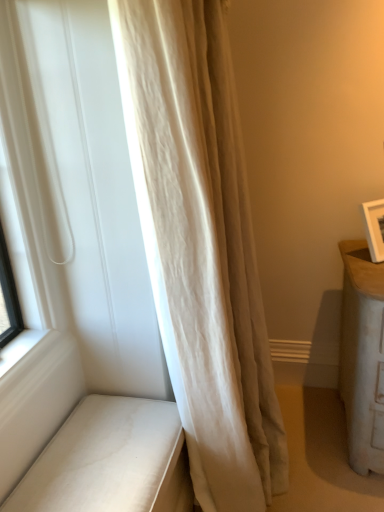
Question: Should I look upward or downward to see white leather bench at lower left?

Choices:
 (A) down
 (B) up

Answer: (A)

Question: Can you confirm if white leather bench at lower left is positioned to the left of beige silk curtain at left?

Choices:
 (A) no
 (B) yes

Answer: (B)

Question: Does white leather bench at lower left come behind beige silk curtain at left?

Choices:
 (A) no
 (B) yes

Answer: (B)

Question: Can you confirm if white leather bench at lower left is smaller than beige silk curtain at left?

Choices:
 (A) no
 (B) yes

Answer: (B)

Question: From the image's perspective, is white leather bench at lower left over beige silk curtain at left?

Choices:
 (A) yes
 (B) no

Answer: (B)

Question: Is white leather bench at lower left thinner than beige silk curtain at left?

Choices:
 (A) yes
 (B) no

Answer: (A)

Question: Would you consider white leather bench at lower left to be distant from beige silk curtain at left?

Choices:
 (A) yes
 (B) no

Answer: (B)

Question: Considering the relative sizes of beige silk curtain at left and white leather bench at lower left in the image provided, is beige silk curtain at left smaller than white leather bench at lower left?

Choices:
 (A) no
 (B) yes

Answer: (A)

Question: Does beige silk curtain at left have a larger size compared to white leather bench at lower left?

Choices:
 (A) yes
 (B) no

Answer: (A)

Question: From the image's perspective, is beige silk curtain at left under white leather bench at lower left?

Choices:
 (A) yes
 (B) no

Answer: (B)

Question: Is the position of beige silk curtain at left less distant than that of white leather bench at lower left?

Choices:
 (A) no
 (B) yes

Answer: (B)

Question: Is beige silk curtain at left facing towards white leather bench at lower left?

Choices:
 (A) yes
 (B) no

Answer: (B)

Question: Is beige silk curtain at left taller than white leather bench at lower left?

Choices:
 (A) no
 (B) yes

Answer: (B)

Question: Considering the positions of beige silk curtain at left and white leather bench at lower left in the image, is beige silk curtain at left wider or thinner than white leather bench at lower left?

Choices:
 (A) thin
 (B) wide

Answer: (B)